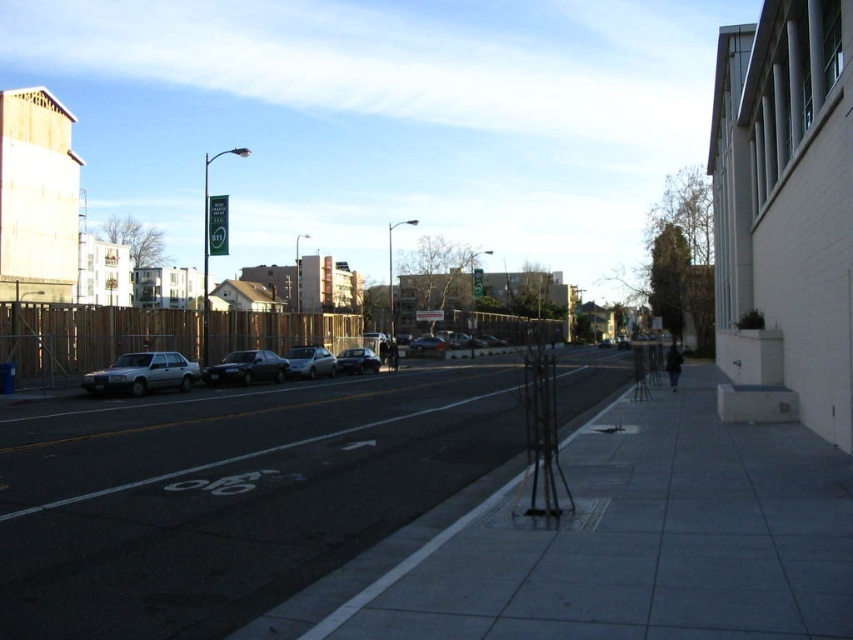
Who is taller, shiny black sedan at center or satin silver sedan at center?

satin silver sedan at center is taller.

Is point (258, 356) less distant than point (326, 356)?

Yes, it is.

The image size is (853, 640). Find the location of `shiny black sedan at center`. shiny black sedan at center is located at coordinates (247, 369).

Is silver metallic sedan at left above satin silver sedan at center?

Actually, silver metallic sedan at left is below satin silver sedan at center.

Can you confirm if silver metallic sedan at left is positioned to the left of satin silver sedan at center?

Yes, silver metallic sedan at left is to the left of satin silver sedan at center.

At what (x,y) coordinates should I click in order to perform the action: click on silver metallic sedan at left. Please return your answer as a coordinate pair (x, y). Looking at the image, I should click on (143, 372).

Which is in front, point (305, 506) or point (210, 246)?

Point (305, 506) is in front.

Based on the photo, is dark asphalt road at center closer to the viewer compared to green plastic sign at upper center?

Yes, dark asphalt road at center is closer to the viewer.

Which is in front, point (561, 410) or point (212, 209)?

Point (561, 410) is more forward.

Identify the location of dark asphalt road at center. The height and width of the screenshot is (640, 853). (227, 493).